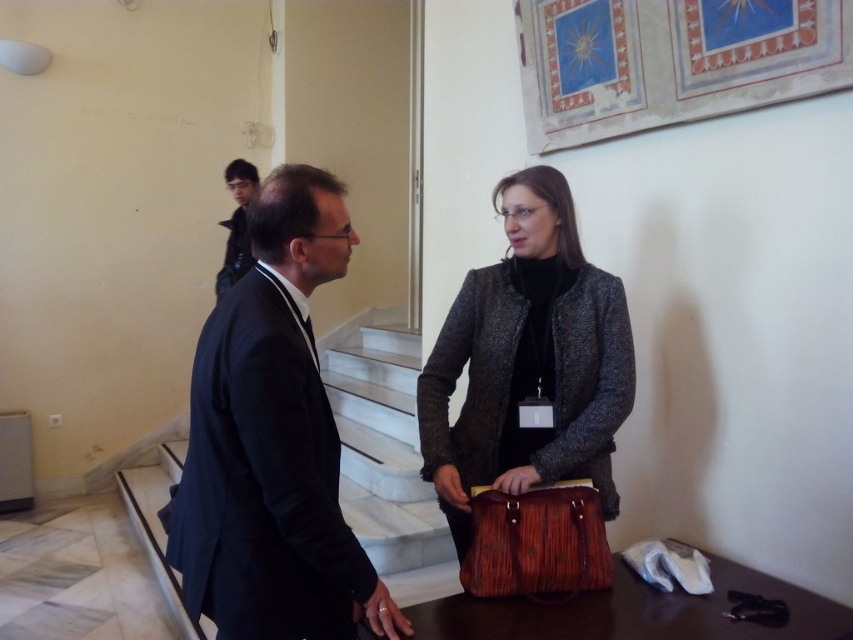
Question: Is black suit at center behind black leather jacket at upper left?

Choices:
 (A) no
 (B) yes

Answer: (A)

Question: Estimate the real-world distances between objects in this image. Which object is farther from the textured gray coat at center?

Choices:
 (A) black leather jacket at upper left
 (B) black suit at center
 (C) wooden briefcase at center

Answer: (A)

Question: Where is textured gray coat at center located in relation to wooden briefcase at center in the image?

Choices:
 (A) right
 (B) left

Answer: (A)

Question: Does textured gray coat at center appear under black leather jacket at upper left?

Choices:
 (A) no
 (B) yes

Answer: (B)

Question: Which point is farther to the camera?

Choices:
 (A) (236, 193)
 (B) (212, 580)

Answer: (A)

Question: Which of the following is the closest to the observer?

Choices:
 (A) (225, 246)
 (B) (459, 564)

Answer: (B)